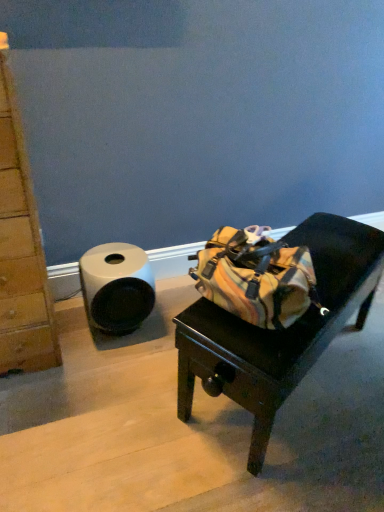
You are a GUI agent. You are given a task and a screenshot of the screen. Output one action in this format:
    pyautogui.click(x=<x>, y=<y>)
    Task: Click on the vacant area that lies to the right of white matte toilet paper at left
    The width and height of the screenshot is (384, 512).
    Given the screenshot: What is the action you would take?
    pyautogui.click(x=166, y=324)